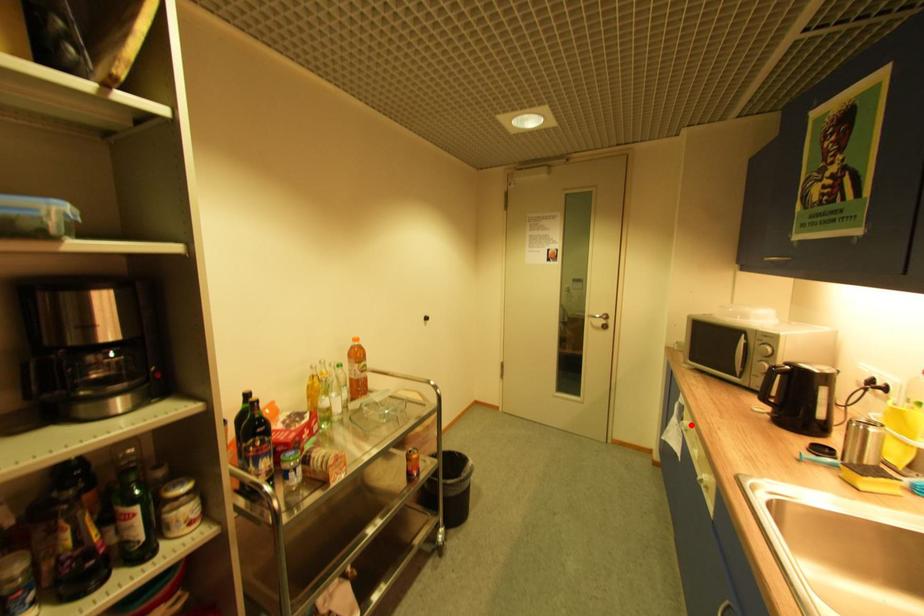
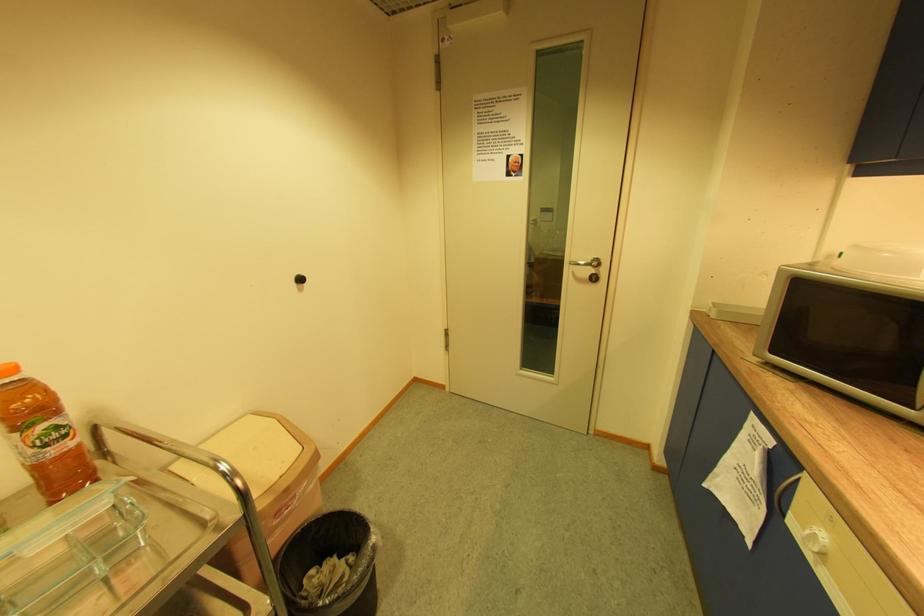
Find the pixel in the second image that matches the highlighted location in the first image.

(825, 540)